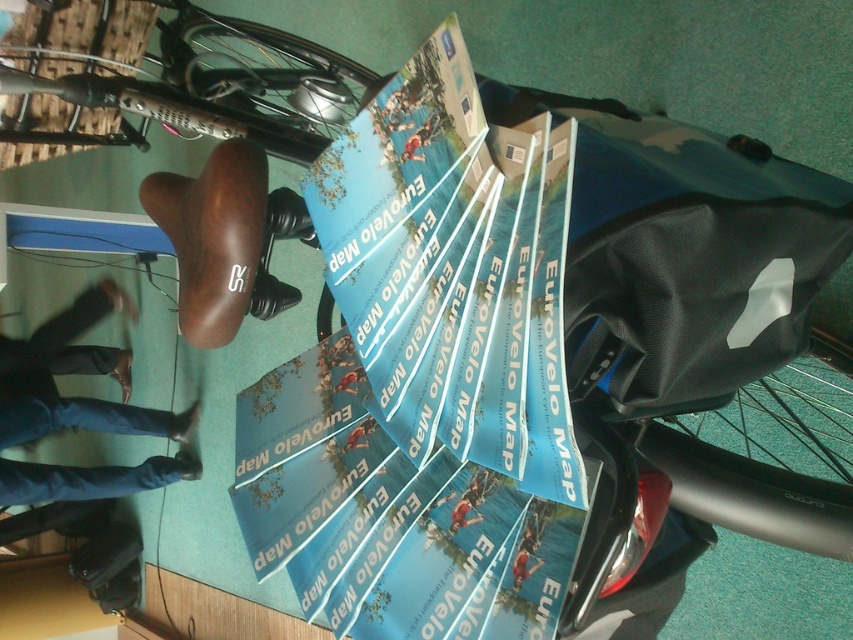
Is matte black bag at center taller than blue paper map at center?

Yes, matte black bag at center is taller than blue paper map at center.

Who is lower down, matte black bag at center or blue paper map at center?

blue paper map at center is lower down.

Who is more distant from viewer, (x=642, y=269) or (x=456, y=531)?

Positioned behind is point (x=456, y=531).

Locate an element on the screen. Image resolution: width=853 pixels, height=640 pixels. matte black bag at center is located at coordinates (686, 244).

Does blue jeans at lower left have a greater width compared to blue paper map at center?

Yes, blue jeans at lower left is wider than blue paper map at center.

Does blue jeans at lower left have a larger size compared to blue paper map at center?

Indeed, blue jeans at lower left has a larger size compared to blue paper map at center.

Between point (99, 490) and point (471, 499), which one is positioned in front?

Point (471, 499)

This screenshot has height=640, width=853. In order to click on blue jeans at lower left in this screenshot , I will do `click(90, 480)`.

Does matte black bag at center appear on the left side of blue fabric map at center?

In fact, matte black bag at center is to the right of blue fabric map at center.

Is matte black bag at center taller than blue fabric map at center?

Indeed, matte black bag at center has a greater height compared to blue fabric map at center.

Is point (570, 324) positioned before point (520, 588)?

Yes, point (570, 324) is in front of point (520, 588).

Where is `matte black bag at center`? matte black bag at center is located at coordinates (686, 244).